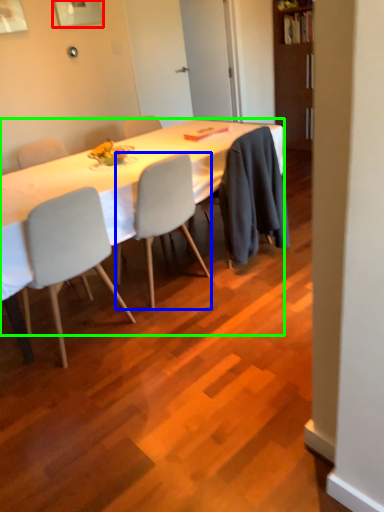
Question: Considering the real-world distances, which object is farthest from picture frame (highlighted by a red box)? chair (highlighted by a blue box) or desk (highlighted by a green box)?

Choices:
 (A) chair
 (B) desk

Answer: (A)